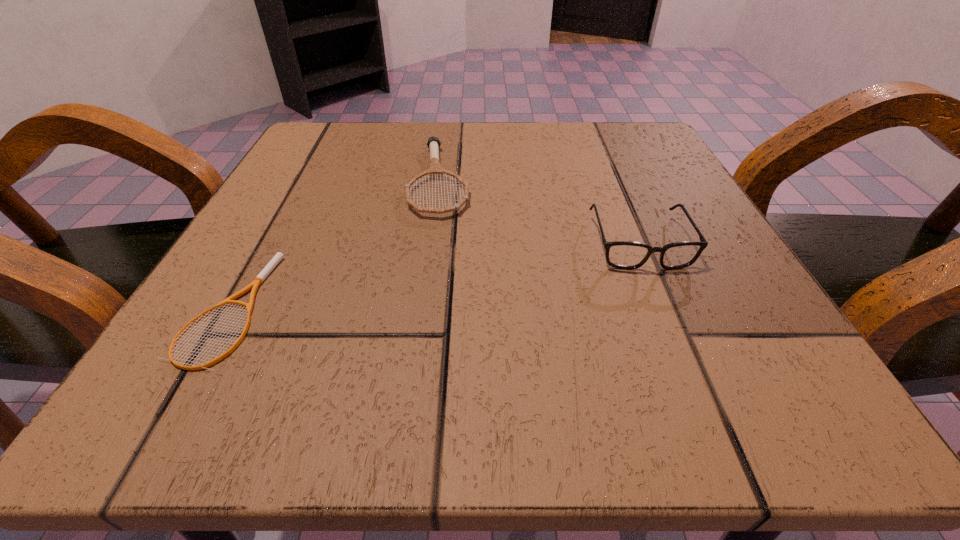
What are the coordinates of `free space that is in between the tallest object and the leftmost object` in the screenshot? It's located at (433, 275).

Locate an element on the screen. This screenshot has height=540, width=960. empty space between the tallest object and the second tallest object is located at coordinates (539, 211).

Where is `vacant area between the spectacles and the second shortest object`? The width and height of the screenshot is (960, 540). vacant area between the spectacles and the second shortest object is located at coordinates (539, 211).

You are a GUI agent. You are given a task and a screenshot of the screen. Output one action in this format:
    pyautogui.click(x=<x>, y=<y>)
    Task: Click on the free space that is in between the taller tennis racket and the shortest object
    This screenshot has width=960, height=540.
    Given the screenshot: What is the action you would take?
    pyautogui.click(x=333, y=244)

You are a GUI agent. You are given a task and a screenshot of the screen. Output one action in this format:
    pyautogui.click(x=<x>, y=<y>)
    Task: Click on the free space between the nearer tennis racket and the spectacles
    
    Given the screenshot: What is the action you would take?
    pyautogui.click(x=433, y=275)

Find the location of a particular element. vacant point located between the right tennis racket and the spectacles is located at coordinates (539, 211).

Locate an element on the screen. The height and width of the screenshot is (540, 960). free space between the shortest object and the farther tennis racket is located at coordinates (333, 244).

Where is `free space between the shorter tennis racket and the second object from right to left`? free space between the shorter tennis racket and the second object from right to left is located at coordinates [x=333, y=244].

Identify the location of vacant space in between the leftmost object and the farther tennis racket. (333, 244).

Where is `empty location between the rightmost object and the taller tennis racket`? The height and width of the screenshot is (540, 960). empty location between the rightmost object and the taller tennis racket is located at coordinates (539, 211).